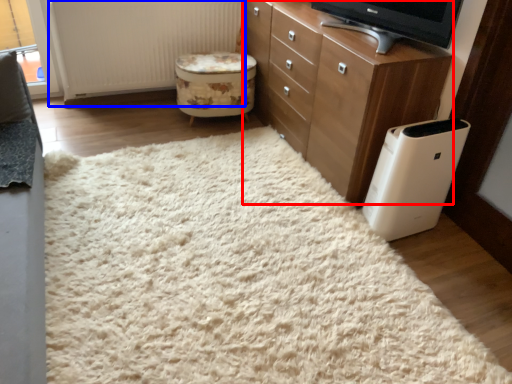
Question: Which of the following is the closest to the observer, chest of drawers (highlighted by a red box) or radiator (highlighted by a blue box)?

Choices:
 (A) chest of drawers
 (B) radiator

Answer: (A)